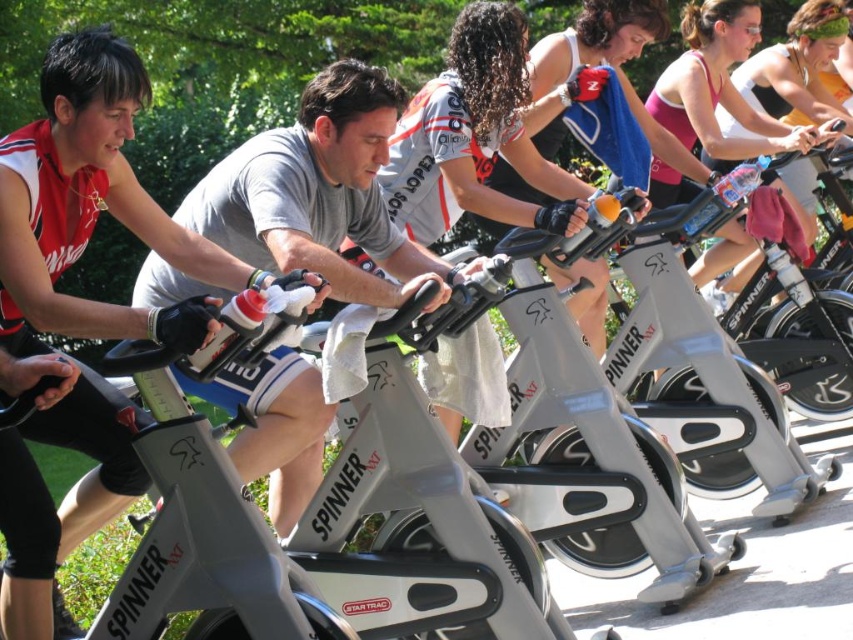
Question: Which object appears farthest from the camera in this image?

Choices:
 (A) pink fabric tank top at upper center
 (B) matte black tank top at left

Answer: (A)

Question: Does gray matte spin bike at center appear over pink fabric tank top at upper center?

Choices:
 (A) yes
 (B) no

Answer: (B)

Question: Does matte black tank top at left come behind gray matte spin bike at center?

Choices:
 (A) no
 (B) yes

Answer: (A)

Question: Where is gray matte spin bike at center located in relation to pink fabric tank top at upper center in the image?

Choices:
 (A) above
 (B) below

Answer: (B)

Question: Which point is farther to the camera?

Choices:
 (A) gray matte spin bike at center
 (B) matte black tank top at left

Answer: (A)

Question: Which point is closer to the camera taking this photo?

Choices:
 (A) (751, 252)
 (B) (107, 458)
 (C) (387, 305)

Answer: (C)